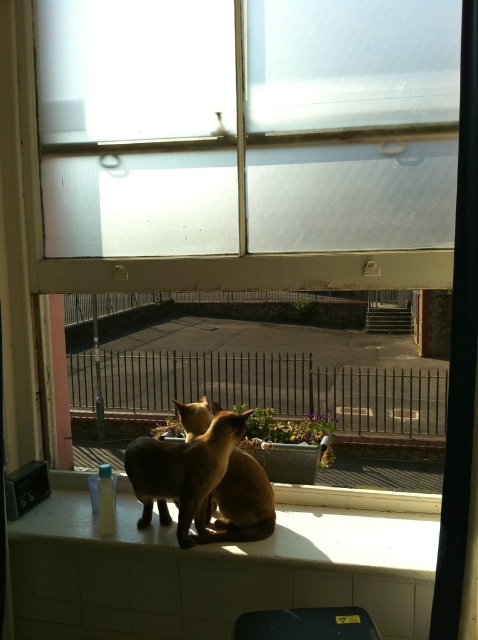
You are standing in the room and want to reach the point at coordinates point (433, 506). If your arm can extend 2 meters, can you reach it?

The point (433, 506) is 2.15 meters away from the viewer, so your arm can only extend 2 meters, which is shorter than the distance. Therefore, you cannot reach it.

You are a cat owner who wants to place a small toy between the satin brown cat at center and the golden fur cat at center on the windowsill. Which cat should you place the toy closer to if you want it to be closer to the left side of the windowsill?

The golden fur cat at center is on the left side of the satin brown cat at center. To place the toy closer to the left side of the windowsill, position it near the golden fur cat at center since it is closer to the left edge.